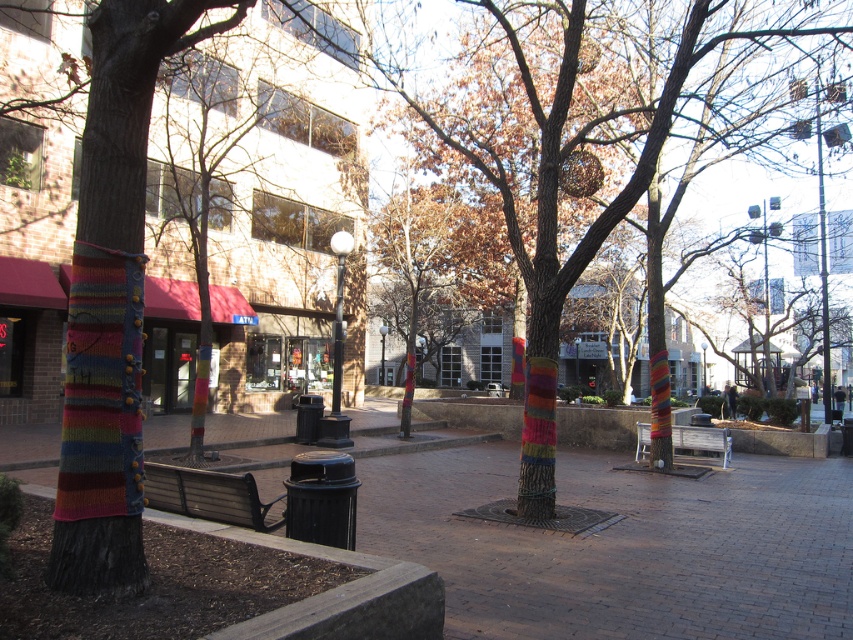
Question: Is brick pavement at center thinner than knitted yarn tree at center?

Choices:
 (A) no
 (B) yes

Answer: (A)

Question: Among these points, which one is nearest to the camera?

Choices:
 (A) (828, 422)
 (B) (641, 80)
 (C) (38, 476)

Answer: (C)

Question: Does wooden bench at lower left come in front of metallic gray pole at upper right?

Choices:
 (A) yes
 (B) no

Answer: (A)

Question: Considering the relative positions of brick pavement at center and knitted yarn tree at center in the image provided, where is brick pavement at center located with respect to knitted yarn tree at center?

Choices:
 (A) above
 (B) below

Answer: (B)

Question: Among these points, which one is farthest from the camera?

Choices:
 (A) (221, 474)
 (B) (692, 513)
 (C) (619, 195)

Answer: (B)

Question: Which object appears farthest from the camera in this image?

Choices:
 (A) wooden park bench at center
 (B) brick pavement at center

Answer: (A)